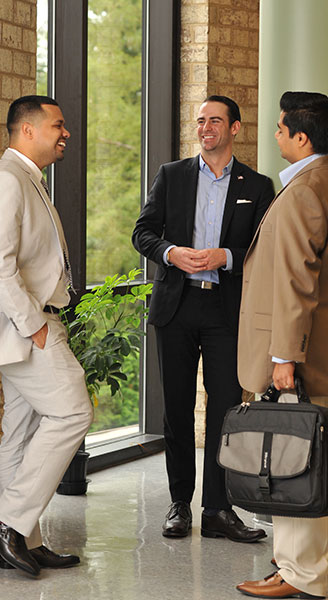
Locate an element on the screen. The width and height of the screenshot is (328, 600). window panes is located at coordinates (118, 74), (41, 53), (118, 394).